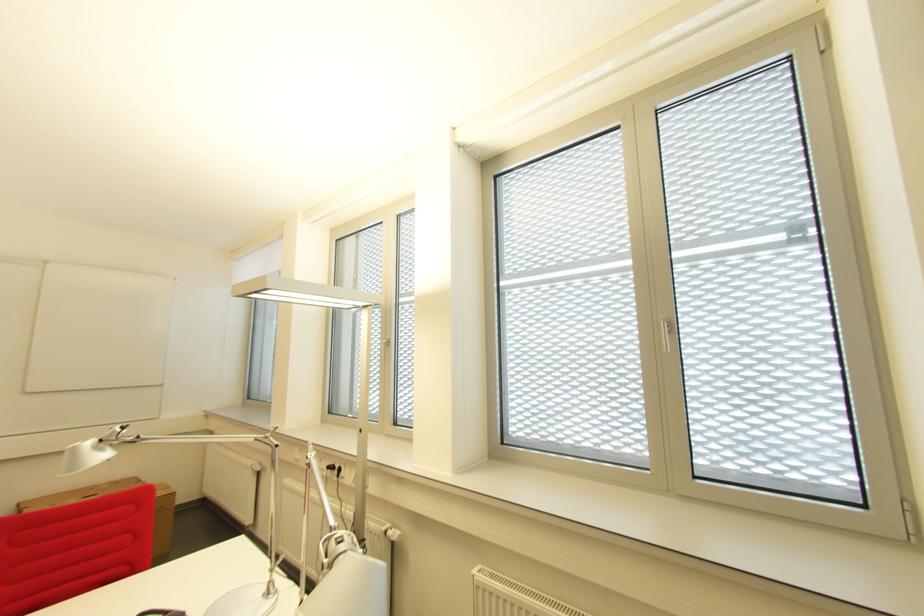
This screenshot has height=616, width=924. In order to click on black electrical plug in this screenshot , I will do `click(334, 469)`.